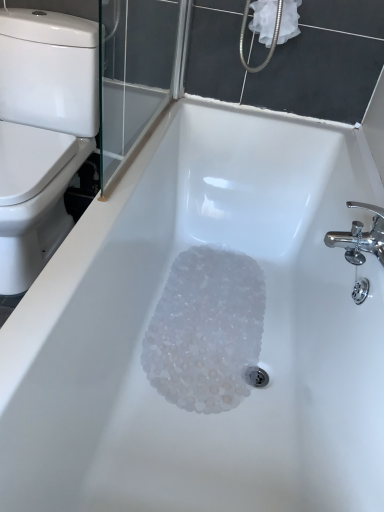
Question: Does point (266, 17) appear closer or farther from the camera than point (178, 309)?

Choices:
 (A) farther
 (B) closer

Answer: (B)

Question: Is white fabric at upper right in front of or behind translucent plastic crystals at bottom in the image?

Choices:
 (A) front
 (B) behind

Answer: (B)

Question: Which of these objects is positioned closest to the white fabric at upper right?

Choices:
 (A) white glossy toilet at left
 (B) translucent plastic crystals at bottom

Answer: (A)

Question: Considering the real-world distances, which object is closest to the white fabric at upper right?

Choices:
 (A) translucent plastic crystals at bottom
 (B) white glossy toilet at left

Answer: (B)